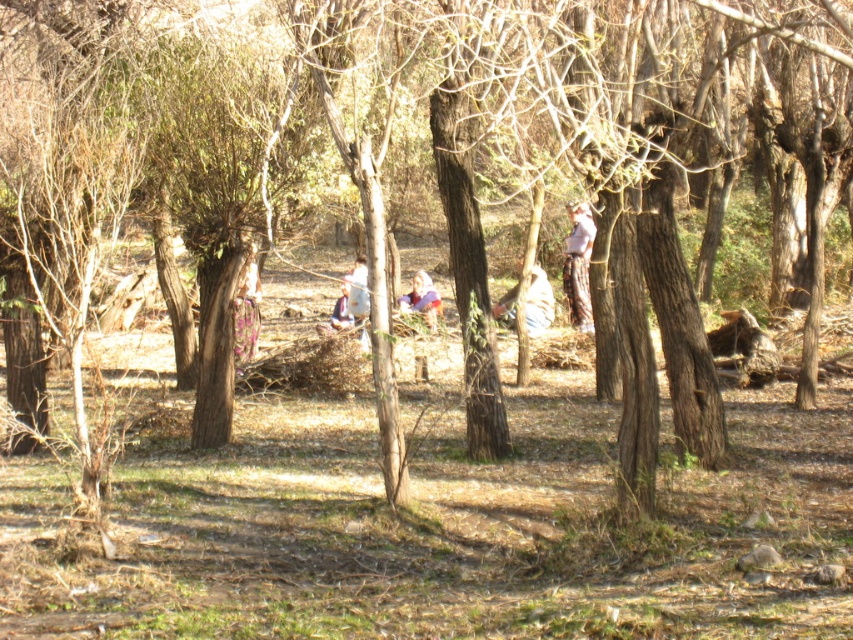
Question: Can you confirm if floral fabric dress at center is positioned to the left of light blue fabric at center?

Choices:
 (A) yes
 (B) no

Answer: (A)

Question: Does floral fabric dress at center appear over light blue fabric at center?

Choices:
 (A) yes
 (B) no

Answer: (B)

Question: Does light brown fabric pants at center appear under floral fabric dress at center?

Choices:
 (A) no
 (B) yes

Answer: (A)

Question: Among these objects, which one is farthest from the camera?

Choices:
 (A) white fabric cloth at center
 (B) light beige fabric at center

Answer: (B)

Question: Which point is closer to the camera taking this photo?

Choices:
 (A) (572, 257)
 (B) (426, 317)
 (C) (546, 298)

Answer: (B)

Question: Which point is farther to the camera?

Choices:
 (A) (416, 269)
 (B) (537, 284)
 (C) (579, 310)
 (D) (361, 264)

Answer: (A)